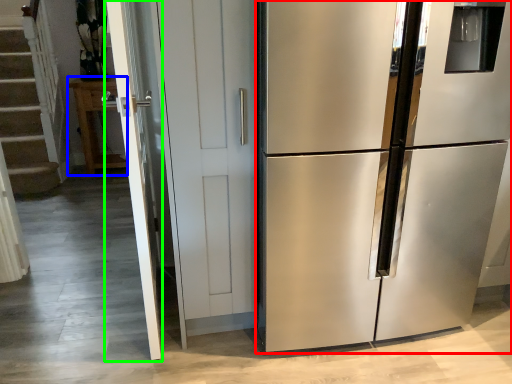
Question: Which object is positioned farthest from refrigerator (highlighted by a red box)? Select from cabinetry (highlighted by a blue box) and screen door (highlighted by a green box).

Choices:
 (A) cabinetry
 (B) screen door

Answer: (A)